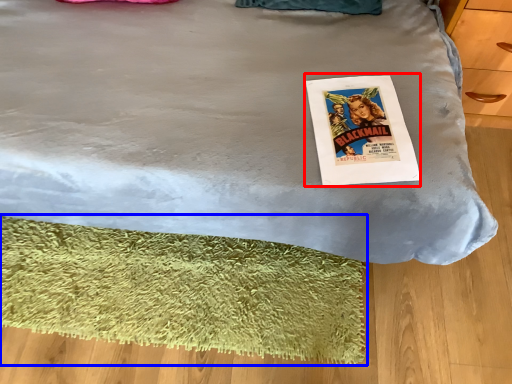
Question: Which object is closer to the camera taking this photo, magazine (highlighted by a red box) or mat (highlighted by a blue box)?

Choices:
 (A) magazine
 (B) mat

Answer: (A)